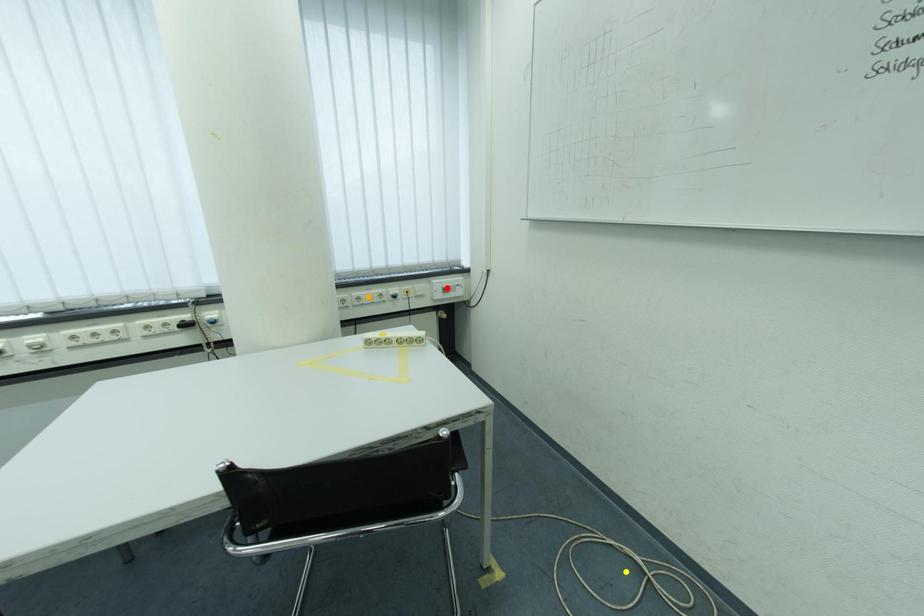
Order these from nearest to farthest:
A) orange point
B) yellow point
C) red point

1. red point
2. orange point
3. yellow point